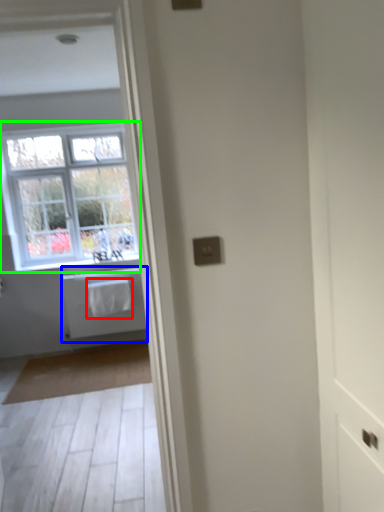
Question: Which is nearer to the laundry (highlighted by a red box)? bath (highlighted by a blue box) or window (highlighted by a green box).

Choices:
 (A) bath
 (B) window

Answer: (A)